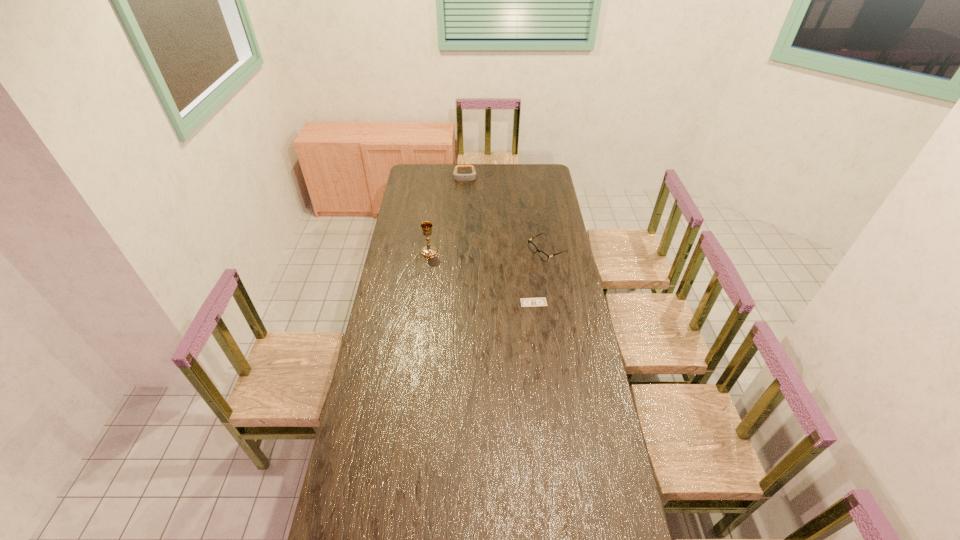
In order to click on vacant area that lies between the nearest object and the tallest object in this screenshot , I will do `click(481, 278)`.

Where is `vacant area that lies between the spectacles and the leftmost object`? Image resolution: width=960 pixels, height=540 pixels. vacant area that lies between the spectacles and the leftmost object is located at coordinates (488, 252).

Find the location of a particular element. The image size is (960, 540). free space between the spectacles and the second object from left to right is located at coordinates (506, 214).

Where is `free space between the tallest object and the third object from right to left`? Image resolution: width=960 pixels, height=540 pixels. free space between the tallest object and the third object from right to left is located at coordinates (447, 214).

Locate an element on the screen. The width and height of the screenshot is (960, 540). object that stands as the second closest to the leftmost object is located at coordinates (525, 302).

What are the coordinates of `object identified as the closest to the farthest object` in the screenshot? It's located at (533, 248).

Find the location of a particular element. The image size is (960, 540). free space that satisfies the following two spatial constraints: 1. on the front side of the spectacles; 2. on the right side of the farthest object is located at coordinates (462, 251).

Identify the location of free space that satisfies the following two spatial constraints: 1. on the front side of the money; 2. on the left side of the chalice. The height and width of the screenshot is (540, 960). (422, 302).

This screenshot has width=960, height=540. I want to click on free spot that satisfies the following two spatial constraints: 1. on the front side of the nearest object; 2. on the left side of the tallest object, so click(x=422, y=302).

Image resolution: width=960 pixels, height=540 pixels. What are the coordinates of `free spot that satisfies the following two spatial constraints: 1. on the front side of the goggles; 2. on the right side of the spectacles` in the screenshot? It's located at (462, 251).